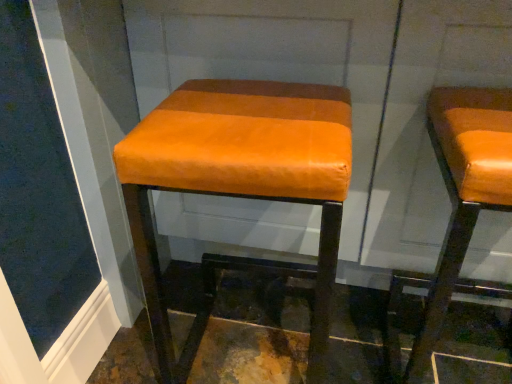
This screenshot has height=384, width=512. What do you see at coordinates (456, 210) in the screenshot?
I see `orange leather stool at right, the 1th stool positioned from the right` at bounding box center [456, 210].

The width and height of the screenshot is (512, 384). Find the location of `orange leather stool at right, the 1th stool positioned from the right`. orange leather stool at right, the 1th stool positioned from the right is located at coordinates (456, 210).

In order to face orange leather stool at center, placed as the 1th stool when sorted from left to right, should I rotate leftwards or rightwards?

To align with it, rotate left about 0.650°.

Identify the location of orange leather stool at center, placed as the 1th stool when sorted from left to right. This screenshot has width=512, height=384. (238, 182).

Measure the distance between orange leather stool at center, marked as the second stool in a right-to-left arrangement, and camera.

A distance of 23.26 inches exists between orange leather stool at center, marked as the second stool in a right-to-left arrangement, and camera.

The height and width of the screenshot is (384, 512). What do you see at coordinates (238, 182) in the screenshot?
I see `orange leather stool at center, placed as the 1th stool when sorted from left to right` at bounding box center [238, 182].

This screenshot has width=512, height=384. Identify the location of orange leather stool at right, the 1th stool positioned from the right. (456, 210).

Is orange leather stool at center, marked as the second stool in a right-to-left arrangement, to the left or to the right of orange leather stool at right, placed as the 2th stool when sorted from left to right, in the image?

orange leather stool at center, marked as the second stool in a right-to-left arrangement, is positioned on orange leather stool at right, placed as the 2th stool when sorted from left to right,'s left side.

Considering the relative positions of orange leather stool at center, marked as the second stool in a right-to-left arrangement, and orange leather stool at right, placed as the 2th stool when sorted from left to right, in the image provided, is orange leather stool at center, marked as the second stool in a right-to-left arrangement, behind orange leather stool at right, placed as the 2th stool when sorted from left to right,?

Yes.

Does point (328, 166) lie in front of point (455, 178)?

Yes, point (328, 166) is in front of point (455, 178).

From the image's perspective, is orange leather stool at center, marked as the second stool in a right-to-left arrangement, over orange leather stool at right, the 1th stool positioned from the right?

Yes, from the image's perspective, orange leather stool at center, marked as the second stool in a right-to-left arrangement, is over orange leather stool at right, the 1th stool positioned from the right.

From a real-world perspective, is orange leather stool at center, placed as the 1th stool when sorted from left to right, physically located above or below orange leather stool at right, placed as the 2th stool when sorted from left to right?

Clearly, from a real-world perspective, orange leather stool at center, placed as the 1th stool when sorted from left to right, is below orange leather stool at right, placed as the 2th stool when sorted from left to right.

Does orange leather stool at center, marked as the second stool in a right-to-left arrangement, have a greater width compared to orange leather stool at right, placed as the 2th stool when sorted from left to right?

Incorrect, the width of orange leather stool at center, marked as the second stool in a right-to-left arrangement, does not surpass that of orange leather stool at right, placed as the 2th stool when sorted from left to right.

Between orange leather stool at center, marked as the second stool in a right-to-left arrangement, and orange leather stool at right, placed as the 2th stool when sorted from left to right, which one has more height?

orange leather stool at center, marked as the second stool in a right-to-left arrangement.

Considering the relative sizes of orange leather stool at center, placed as the 1th stool when sorted from left to right, and orange leather stool at right, placed as the 2th stool when sorted from left to right, in the image provided, is orange leather stool at center, placed as the 1th stool when sorted from left to right, bigger than orange leather stool at right, placed as the 2th stool when sorted from left to right,?

Yes.

Is orange leather stool at right, the 1th stool positioned from the right, located within orange leather stool at center, placed as the 1th stool when sorted from left to right?

Definitely not — orange leather stool at right, the 1th stool positioned from the right, is not inside orange leather stool at center, placed as the 1th stool when sorted from left to right.

Is orange leather stool at center, marked as the second stool in a right-to-left arrangement, not close to orange leather stool at right, the 1th stool positioned from the right?

orange leather stool at center, marked as the second stool in a right-to-left arrangement, is near orange leather stool at right, the 1th stool positioned from the right, not far away.

Is orange leather stool at center, marked as the second stool in a right-to-left arrangement, aimed at orange leather stool at right, the 1th stool positioned from the right?

No, orange leather stool at center, marked as the second stool in a right-to-left arrangement, does not turn towards orange leather stool at right, the 1th stool positioned from the right.

How different are the orientations of orange leather stool at center, placed as the 1th stool when sorted from left to right, and orange leather stool at right, placed as the 2th stool when sorted from left to right, in degrees?

The angle between the facing direction of orange leather stool at center, placed as the 1th stool when sorted from left to right, and the facing direction of orange leather stool at right, placed as the 2th stool when sorted from left to right, is 2.26 degrees.

The height and width of the screenshot is (384, 512). Find the location of `stool that is above the orange leather stool at center, placed as the 1th stool when sorted from left to right (from a real-world perspective)`. stool that is above the orange leather stool at center, placed as the 1th stool when sorted from left to right (from a real-world perspective) is located at coordinates (456, 210).

Which is more to the left, orange leather stool at right, placed as the 2th stool when sorted from left to right, or orange leather stool at center, marked as the second stool in a right-to-left arrangement?

orange leather stool at center, marked as the second stool in a right-to-left arrangement, is more to the left.

Is orange leather stool at right, the 1th stool positioned from the right, in front of or behind orange leather stool at center, marked as the second stool in a right-to-left arrangement, in the image?

Visually, orange leather stool at right, the 1th stool positioned from the right, is located in front of orange leather stool at center, marked as the second stool in a right-to-left arrangement.

Is point (479, 281) closer to viewer compared to point (279, 160)?

No, (479, 281) is further to viewer.

From the image's perspective, between orange leather stool at right, the 1th stool positioned from the right, and orange leather stool at center, marked as the second stool in a right-to-left arrangement, who is located below?

orange leather stool at right, the 1th stool positioned from the right.

From a real-world perspective, is orange leather stool at right, the 1th stool positioned from the right, under orange leather stool at center, marked as the second stool in a right-to-left arrangement?

Actually, orange leather stool at right, the 1th stool positioned from the right, is physically above orange leather stool at center, marked as the second stool in a right-to-left arrangement, in the real world.

Does orange leather stool at right, the 1th stool positioned from the right, have a lesser width compared to orange leather stool at center, placed as the 1th stool when sorted from left to right?

In fact, orange leather stool at right, the 1th stool positioned from the right, might be wider than orange leather stool at center, placed as the 1th stool when sorted from left to right.

Does orange leather stool at right, the 1th stool positioned from the right, have a lesser height compared to orange leather stool at center, placed as the 1th stool when sorted from left to right?

Correct, orange leather stool at right, the 1th stool positioned from the right, is not as tall as orange leather stool at center, placed as the 1th stool when sorted from left to right.

Considering the sizes of objects orange leather stool at right, placed as the 2th stool when sorted from left to right, and orange leather stool at center, placed as the 1th stool when sorted from left to right, in the image provided, who is smaller, orange leather stool at right, placed as the 2th stool when sorted from left to right, or orange leather stool at center, placed as the 1th stool when sorted from left to right,?

orange leather stool at right, placed as the 2th stool when sorted from left to right, is smaller.

From the picture: Is orange leather stool at center, placed as the 1th stool when sorted from left to right, surrounded by orange leather stool at right, the 1th stool positioned from the right?

No, orange leather stool at center, placed as the 1th stool when sorted from left to right, is located outside of orange leather stool at right, the 1th stool positioned from the right.

Are orange leather stool at right, the 1th stool positioned from the right, and orange leather stool at center, placed as the 1th stool when sorted from left to right, located far from each other?

No, orange leather stool at right, the 1th stool positioned from the right, is not far from orange leather stool at center, placed as the 1th stool when sorted from left to right.

Is orange leather stool at right, placed as the 2th stool when sorted from left to right, oriented away from orange leather stool at center, placed as the 1th stool when sorted from left to right?

No, orange leather stool at right, placed as the 2th stool when sorted from left to right,'s orientation is not away from orange leather stool at center, placed as the 1th stool when sorted from left to right.

How different are the orientations of orange leather stool at right, placed as the 2th stool when sorted from left to right, and orange leather stool at center, placed as the 1th stool when sorted from left to right, in degrees?

The angle between the facing direction of orange leather stool at right, placed as the 2th stool when sorted from left to right, and the facing direction of orange leather stool at center, placed as the 1th stool when sorted from left to right, is 2.26 degrees.

The height and width of the screenshot is (384, 512). I want to click on stool on the right of orange leather stool at center, marked as the second stool in a right-to-left arrangement, so click(456, 210).

Identify the location of stool on the right of orange leather stool at center, marked as the second stool in a right-to-left arrangement. (456, 210).

Identify the location of stool that appears above the orange leather stool at right, the 1th stool positioned from the right (from the image's perspective). (238, 182).